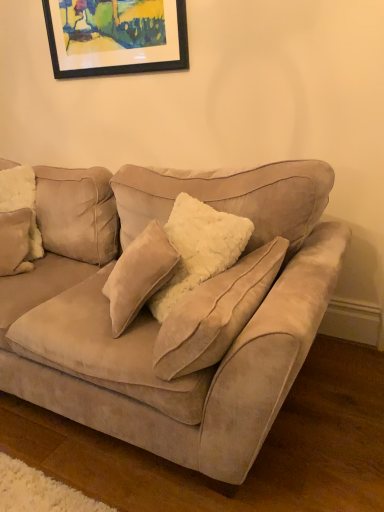
The width and height of the screenshot is (384, 512). Describe the element at coordinates (21, 201) in the screenshot. I see `fuzzy beige pillow at left` at that location.

Identify the location of suede couch at center. (156, 321).

Image resolution: width=384 pixels, height=512 pixels. What are the coordinates of `black framed picture at upper center` in the screenshot? It's located at (116, 36).

How many degrees apart are the facing directions of fuzzy beige pillow at left and suede couch at center?

The angular difference between fuzzy beige pillow at left and suede couch at center is 37.7 degrees.

Which object is thinner, fuzzy beige pillow at left or suede couch at center?

With smaller width is fuzzy beige pillow at left.

What are the coordinates of `studio couch located underneath the fuzzy beige pillow at left (from a real-world perspective)` in the screenshot? It's located at (x=156, y=321).

Which object is further away from the camera, black framed picture at upper center or fuzzy beige pillow at left?

black framed picture at upper center is further away from the camera.

The image size is (384, 512). I want to click on picture frame above the fuzzy beige pillow at left (from a real-world perspective), so click(x=116, y=36).

In the image, is black framed picture at upper center on the left side or the right side of fuzzy beige pillow at left?

Based on their positions, black framed picture at upper center is located to the right of fuzzy beige pillow at left.

From the image's perspective, is black framed picture at upper center on fuzzy beige pillow at left?

Indeed, from the image's perspective, black framed picture at upper center is shown above fuzzy beige pillow at left.

Based on the photo, considering the positions of objects suede couch at center and black framed picture at upper center in the image provided, who is behind, suede couch at center or black framed picture at upper center?

black framed picture at upper center is further away from the camera.

From a real-world perspective, is suede couch at center positioned over black framed picture at upper center based on gravity?

Incorrect, from a real-world perspective, suede couch at center is lower than black framed picture at upper center.

From the image's perspective, does suede couch at center appear higher than black framed picture at upper center?

No, from the image's perspective, suede couch at center is not on top of black framed picture at upper center.

Is suede couch at center located outside black framed picture at upper center?

Yes.

Is fuzzy beige pillow at left positioned with its back to black framed picture at upper center?

No, black framed picture at upper center is not at the back of fuzzy beige pillow at left.

Considering the sizes of objects fuzzy beige pillow at left and black framed picture at upper center in the image provided, who is wider, fuzzy beige pillow at left or black framed picture at upper center?

Wider between the two is fuzzy beige pillow at left.

Considering the positions of objects fuzzy beige pillow at left and black framed picture at upper center in the image provided, who is more to the right, fuzzy beige pillow at left or black framed picture at upper center?

From the viewer's perspective, black framed picture at upper center appears more on the right side.

Does fuzzy beige pillow at left contain black framed picture at upper center?

No.

Could you tell me if suede couch at center is turned towards fuzzy beige pillow at left?

Yes, suede couch at center faces towards fuzzy beige pillow at left.

Can you confirm if suede couch at center is wider than fuzzy beige pillow at left?

Yes, suede couch at center is wider than fuzzy beige pillow at left.

From a real-world perspective, relative to fuzzy beige pillow at left, is suede couch at center vertically above or below?

From a real-world perspective, suede couch at center is physically below fuzzy beige pillow at left.

Which point is more forward, (246, 353) or (29, 251)?

The point (246, 353) is closer to the camera.

Would you consider black framed picture at upper center to be distant from suede couch at center?

That's right, there is a large distance between black framed picture at upper center and suede couch at center.

Can suede couch at center be found inside black framed picture at upper center?

No.

From a real-world perspective, is black framed picture at upper center located beneath suede couch at center?

No.

How many degrees apart are the facing directions of black framed picture at upper center and suede couch at center?

The angle between the facing direction of black framed picture at upper center and the facing direction of suede couch at center is 0.538 degrees.

Find the location of a particular element. The height and width of the screenshot is (512, 384). pillow above the suede couch at center (from the image's perspective) is located at coordinates (21, 201).

This screenshot has width=384, height=512. Find the location of `pillow that is under the black framed picture at upper center (from a real-world perspective)`. pillow that is under the black framed picture at upper center (from a real-world perspective) is located at coordinates (21, 201).

Considering their positions, is black framed picture at upper center positioned further to suede couch at center than fuzzy beige pillow at left?

Based on the image, black framed picture at upper center appears to be further to suede couch at center.

Which object lies further to the anchor point fuzzy beige pillow at left, black framed picture at upper center or suede couch at center?

black framed picture at upper center.

Considering their positions, is fuzzy beige pillow at left positioned closer to black framed picture at upper center than suede couch at center?

fuzzy beige pillow at left lies closer to black framed picture at upper center than the other object.

Consider the image. Considering their positions, is fuzzy beige pillow at left positioned closer to suede couch at center than black framed picture at upper center?

fuzzy beige pillow at left is positioned closer to the anchor suede couch at center.

Which object lies nearer to the anchor point fuzzy beige pillow at left, suede couch at center or black framed picture at upper center?

The object closer to fuzzy beige pillow at left is suede couch at center.

Looking at the image, which one is located further to black framed picture at upper center, suede couch at center or fuzzy beige pillow at left?

suede couch at center lies further to black framed picture at upper center than the other object.

The width and height of the screenshot is (384, 512). What are the coordinates of `pillow between black framed picture at upper center and suede couch at center in the up-down direction` in the screenshot? It's located at (21, 201).